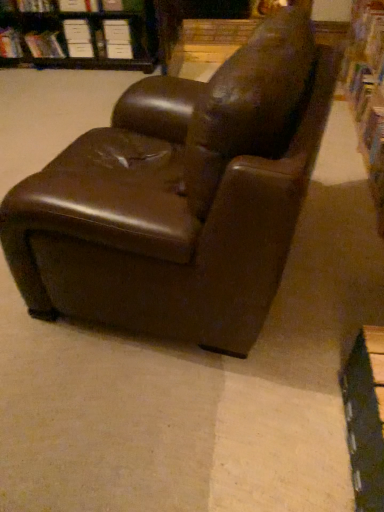
Locate an element on the screen. The height and width of the screenshot is (512, 384). vacant area located to the right-hand side of brown leather chair at center is located at coordinates (334, 246).